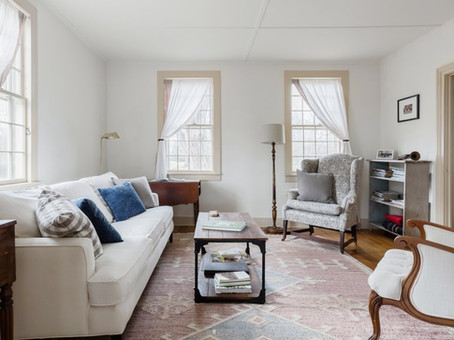
In order to click on white curtains in this screenshot , I will do `click(333, 111)`, `click(181, 94)`, `click(11, 49)`.